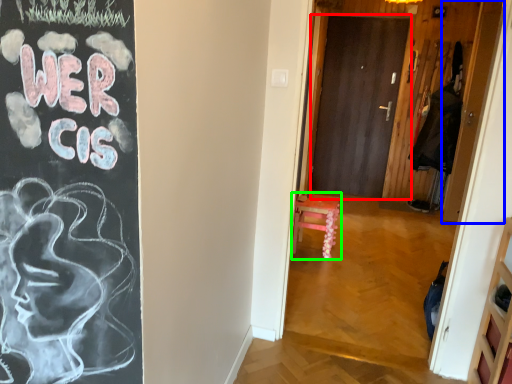
Question: Considering the real-world distances, which object is farthest from door (highlighted by a red box)? door (highlighted by a blue box) or furniture (highlighted by a green box)?

Choices:
 (A) door
 (B) furniture

Answer: (B)